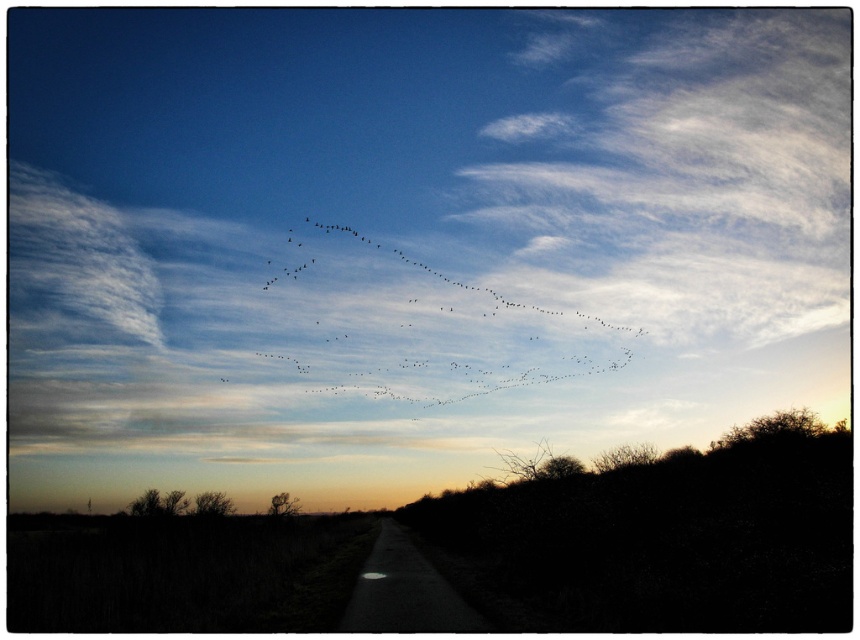
Between white fluffy cloud at upper center and black matte birds at upper center, which one is positioned lower?

black matte birds at upper center

Does white fluffy cloud at upper center have a greater height compared to black matte birds at upper center?

Indeed, white fluffy cloud at upper center has a greater height compared to black matte birds at upper center.

Which is in front, point (574, 148) or point (416, 298)?

Point (416, 298)

Locate an element on the screen. The width and height of the screenshot is (860, 640). white fluffy cloud at upper center is located at coordinates (685, 168).